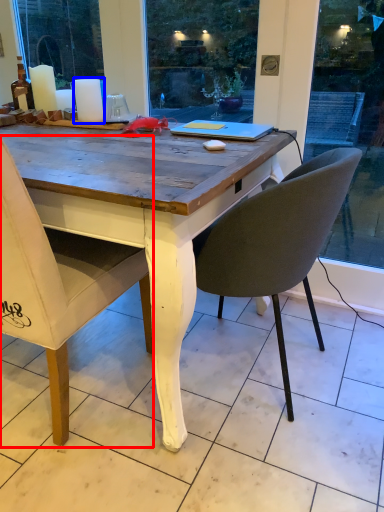
Question: Which of the following is the farthest to the observer, chair (highlighted by a red box) or candle (highlighted by a blue box)?

Choices:
 (A) chair
 (B) candle

Answer: (B)